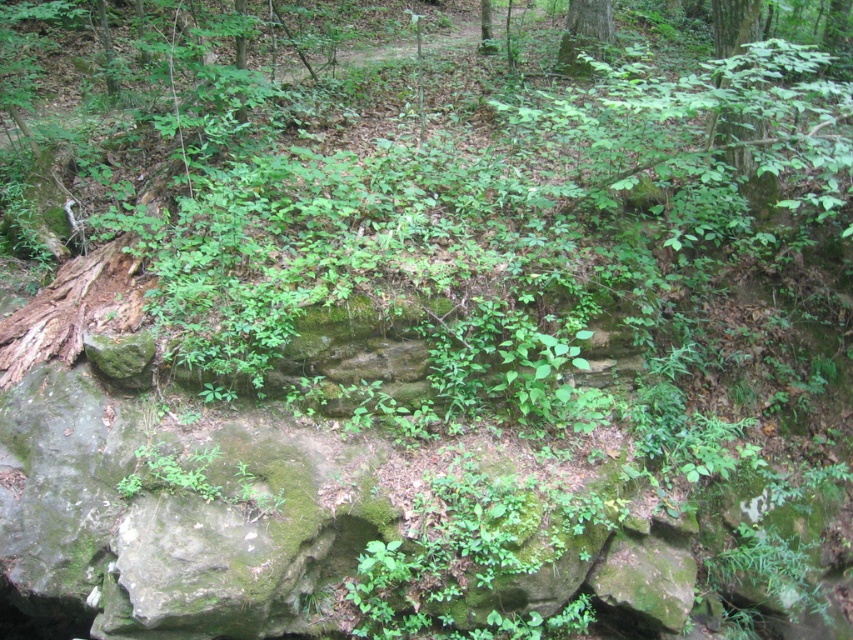
You are a hiker trying to navigate through the forest. You see two green leafy trees ahead of you. Which one would you see first as you approach the forest from the front? The green leafy tree at upper right or the green leafy tree at center?

The green leafy tree at upper right is positioned under the green leafy tree at center, so you would see the green leafy tree at center first as you approach the forest from the front.

You are a hiker carrying a 1.5 meter long hiking pole. You spot the green leafy tree at upper right and the green mossy tree at upper center in the distance. Can you fit your hiking pole horizontally between them without bending it?

The distance between the green leafy tree at upper right and the green mossy tree at upper center is 1.53 meters, which is slightly longer than the 1.5 meter length of the hiking pole. Therefore, you can fit the hiking pole horizontally between them without bending it.

You are an environmental scientist studying the forest layout. You observe the green leafy tree at upper right and the green leafy tree at center. Which tree is located to the right of the other?

The green leafy tree at upper right is positioned on the right side of green leafy tree at center.